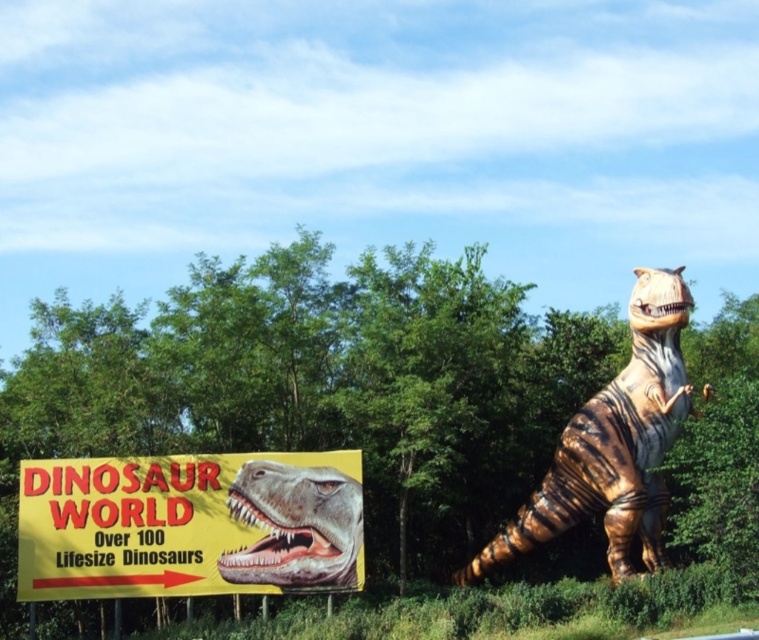
Question: Can you confirm if yellow paper sign at lower left is positioned below striped metallic dinosaur at center?

Choices:
 (A) yes
 (B) no

Answer: (A)

Question: Which of these objects is positioned farthest from the striped metallic dinosaur at center?

Choices:
 (A) shiny metallic dinosaur head at center
 (B) yellow paper sign at lower left

Answer: (A)

Question: Which point is farther to the camera?

Choices:
 (A) (301, 470)
 (B) (650, 502)
 (C) (194, 484)

Answer: (B)

Question: Which of the following is the closest to the observer?

Choices:
 (A) yellow paper sign at lower left
 (B) striped metallic dinosaur at center
 (C) shiny metallic dinosaur head at center

Answer: (A)

Question: Does yellow paper sign at lower left appear under shiny metallic dinosaur head at center?

Choices:
 (A) no
 (B) yes

Answer: (B)

Question: Can you confirm if striped metallic dinosaur at center is wider than shiny metallic dinosaur head at center?

Choices:
 (A) no
 (B) yes

Answer: (B)